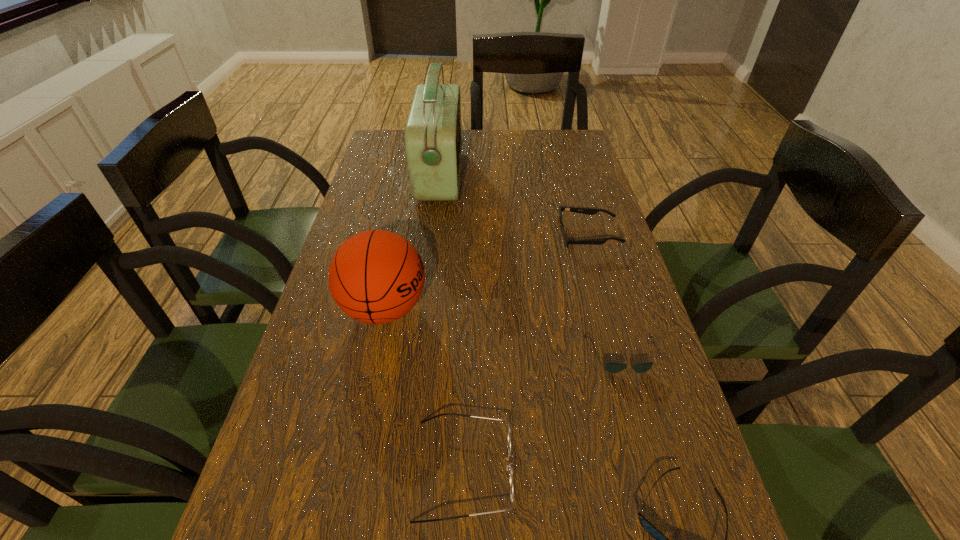
Locate an element on the screen. free space between the basketball and the farthest object is located at coordinates tap(413, 242).

This screenshot has height=540, width=960. Identify the location of free space between the fifth shortest object and the tallest sunglasses. (487, 272).

Image resolution: width=960 pixels, height=540 pixels. I want to click on vacant region between the tallest object and the farthest sunglasses, so click(x=515, y=206).

The height and width of the screenshot is (540, 960). In order to click on free point between the basketball and the second farthest sunglasses in this screenshot , I will do `click(503, 332)`.

The width and height of the screenshot is (960, 540). I want to click on blank region between the farthest sunglasses and the second nearest sunglasses, so click(605, 296).

You are a GUI agent. You are given a task and a screenshot of the screen. Output one action in this format:
    pyautogui.click(x=<x>, y=<y>)
    Task: Click on the vacant space in between the second nearest sunglasses and the basketball
    The width and height of the screenshot is (960, 540).
    Given the screenshot: What is the action you would take?
    pyautogui.click(x=503, y=332)

The width and height of the screenshot is (960, 540). What are the coordinates of `unoccupied position between the spectacles and the fifth nearest object` in the screenshot? It's located at (526, 353).

Find the location of a particular element. The image size is (960, 540). object that can be found as the closest to the fifth shortest object is located at coordinates tap(509, 432).

Select which object appears as the fourth closest to the second nearest sunglasses. Please provide its 2D coordinates. Your answer should be formatted as a tuple, i.e. [(x, y)], where the tuple contains the x and y coordinates of a point satisfying the conditions above.

[(376, 276)]

Locate an element on the screen. The width and height of the screenshot is (960, 540). the third closest sunglasses to the second tallest object is located at coordinates (661, 539).